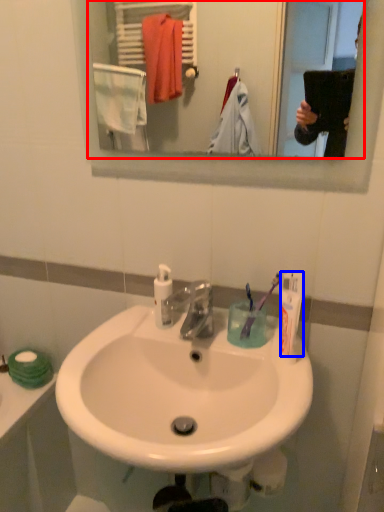
Question: Which object appears farthest to the camera in this image, mirror (highlighted by a red box) or toothpaste (highlighted by a blue box)?

Choices:
 (A) mirror
 (B) toothpaste

Answer: (B)